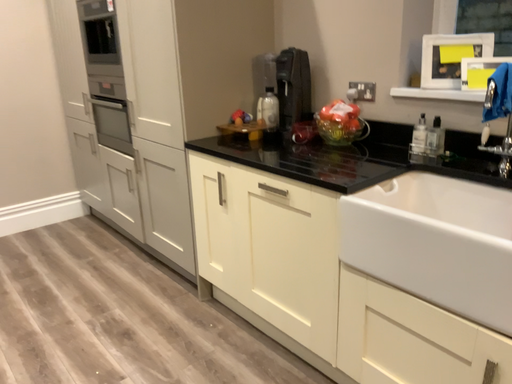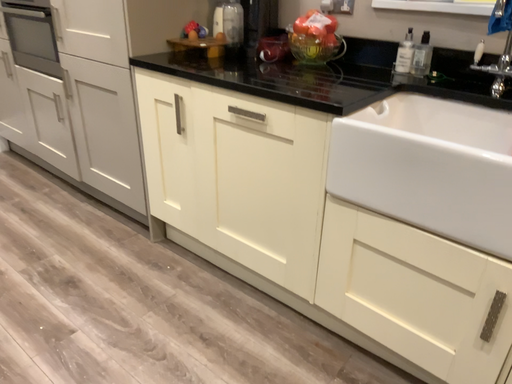
Question: How did the camera likely rotate when shooting the video?

Choices:
 (A) rotated right
 (B) rotated left

Answer: (A)